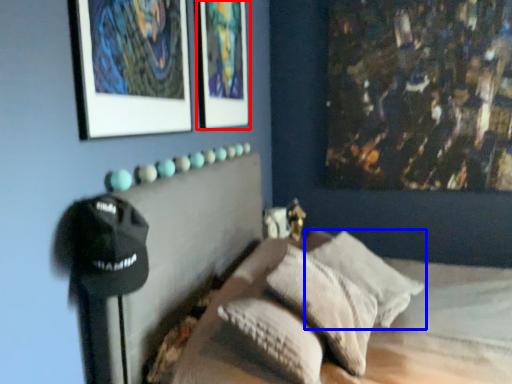
Question: Which object is further to the camera taking this photo, picture frame (highlighted by a red box) or pillow (highlighted by a blue box)?

Choices:
 (A) picture frame
 (B) pillow

Answer: (A)